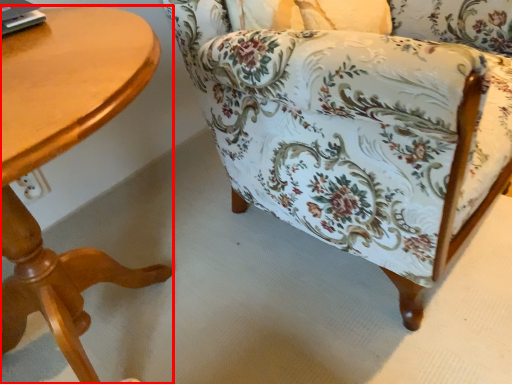
Question: From the image's perspective, considering the relative positions of table (annotated by the red box) and chair in the image provided, where is table (annotated by the red box) located with respect to the staircase?

Choices:
 (A) above
 (B) below

Answer: (B)